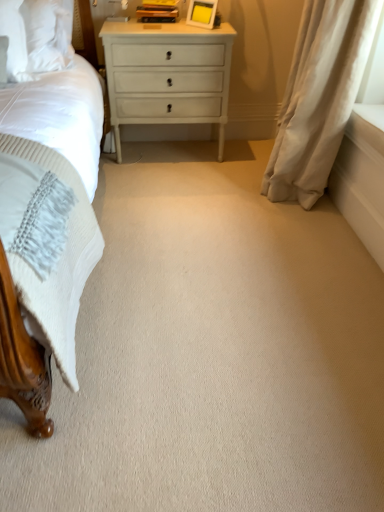
Question: Considering the positions of white glossy nightstand at center and white soft curtain at right in the image, is white glossy nightstand at center bigger or smaller than white soft curtain at right?

Choices:
 (A) big
 (B) small

Answer: (B)

Question: Visually, is white glossy nightstand at center positioned to the left or to the right of white soft curtain at right?

Choices:
 (A) left
 (B) right

Answer: (A)

Question: Does point (168, 83) appear closer or farther from the camera than point (289, 87)?

Choices:
 (A) farther
 (B) closer

Answer: (A)

Question: Is white soft curtain at right wider or thinner than white glossy nightstand at center?

Choices:
 (A) wide
 (B) thin

Answer: (B)

Question: From the image's perspective, is white soft curtain at right above or below white glossy nightstand at center?

Choices:
 (A) below
 (B) above

Answer: (A)

Question: Visually, is white soft curtain at right positioned to the left or to the right of white glossy nightstand at center?

Choices:
 (A) left
 (B) right

Answer: (B)

Question: Which is correct: white soft curtain at right is inside white glossy nightstand at center, or outside of it?

Choices:
 (A) outside
 (B) inside

Answer: (A)